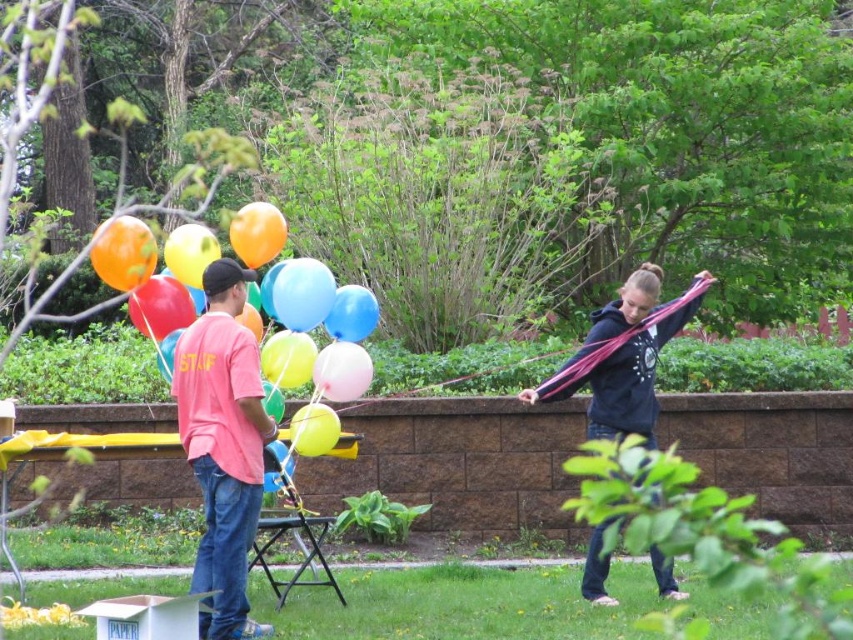
You are planning to take a photo of the dark blue hoodie at center and the shiny multicolored balloons at left. Which object should be positioned closer to the camera to ensure both appear in focus?

The dark blue hoodie at center is bigger than the shiny multicolored balloons at left, so positioning the dark blue hoodie at center closer to the camera will help maintain focus on both objects.

You are a photographer trying to capture a clear shot of the dark blue hoodie at center and the shiny multicolored balloons at left. However, there is a tree branch blocking your view. Where should you position yourself to ensure both objects are visible without obstruction?

Position yourself to the right side of the scene so that the dark blue hoodie at center is visible below the shiny multicolored balloons at left, avoiding the tree branch obstruction.